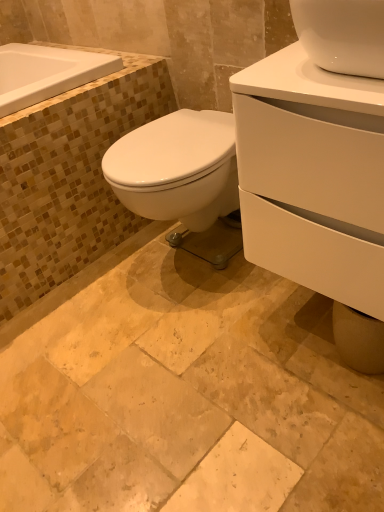
Question: Does white glossy cabinet at right have a lesser height compared to natural stone tile at center?

Choices:
 (A) yes
 (B) no

Answer: (B)

Question: From the image's perspective, is white glossy cabinet at right beneath natural stone tile at center?

Choices:
 (A) yes
 (B) no

Answer: (B)

Question: Does white glossy cabinet at right come behind natural stone tile at center?

Choices:
 (A) no
 (B) yes

Answer: (B)

Question: Does white glossy cabinet at right appear on the right side of natural stone tile at center?

Choices:
 (A) yes
 (B) no

Answer: (A)

Question: Is white glossy cabinet at right thinner than natural stone tile at center?

Choices:
 (A) no
 (B) yes

Answer: (B)

Question: Is white glossy cabinet at right smaller than natural stone tile at center?

Choices:
 (A) yes
 (B) no

Answer: (B)

Question: Can you confirm if white glossy cabinet at right is smaller than white glossy bathtub at upper left?

Choices:
 (A) no
 (B) yes

Answer: (A)

Question: Is white glossy cabinet at right not close to white glossy bathtub at upper left?

Choices:
 (A) no
 (B) yes

Answer: (A)

Question: Considering the relative positions of white glossy cabinet at right and white glossy bathtub at upper left in the image provided, is white glossy cabinet at right to the left of white glossy bathtub at upper left from the viewer's perspective?

Choices:
 (A) no
 (B) yes

Answer: (A)

Question: Could you tell me if white glossy cabinet at right is facing white glossy bathtub at upper left?

Choices:
 (A) yes
 (B) no

Answer: (B)

Question: From a real-world perspective, does white glossy cabinet at right stand above white glossy bathtub at upper left?

Choices:
 (A) yes
 (B) no

Answer: (B)

Question: Considering the relative sizes of white glossy cabinet at right and white glossy bathtub at upper left in the image provided, is white glossy cabinet at right bigger than white glossy bathtub at upper left?

Choices:
 (A) no
 (B) yes

Answer: (B)

Question: Are natural stone tile at center and white glossy cabinet at right far apart?

Choices:
 (A) yes
 (B) no

Answer: (B)